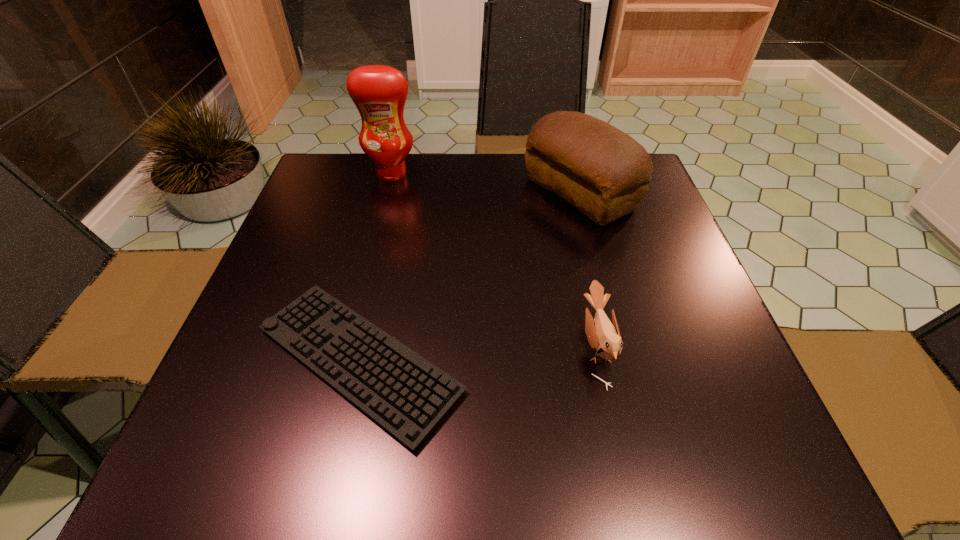
In order to click on condiment that is positioned at the far edge in this screenshot , I will do `click(379, 92)`.

In order to click on bread situated at the far edge in this screenshot , I will do `click(603, 172)`.

This screenshot has height=540, width=960. Find the location of `object located in the near edge section of the desktop`. object located in the near edge section of the desktop is located at coordinates (407, 395).

Identify the location of condiment that is at the left edge. The image size is (960, 540). (379, 92).

You are a GUI agent. You are given a task and a screenshot of the screen. Output one action in this format:
    pyautogui.click(x=<x>, y=<y>)
    Task: Click on the computer keyboard that is at the left edge
    The image size is (960, 540).
    Given the screenshot: What is the action you would take?
    pyautogui.click(x=407, y=395)

This screenshot has width=960, height=540. I want to click on object at the right edge, so click(603, 172).

Locate an element on the screen. The image size is (960, 540). object that is at the far left corner is located at coordinates (379, 92).

Where is `object that is at the near left corner`? object that is at the near left corner is located at coordinates (407, 395).

Image resolution: width=960 pixels, height=540 pixels. Identify the location of object that is at the far right corner. (603, 172).

Find the location of a particular element. This screenshot has width=960, height=540. free region at the far edge of the desktop is located at coordinates (520, 172).